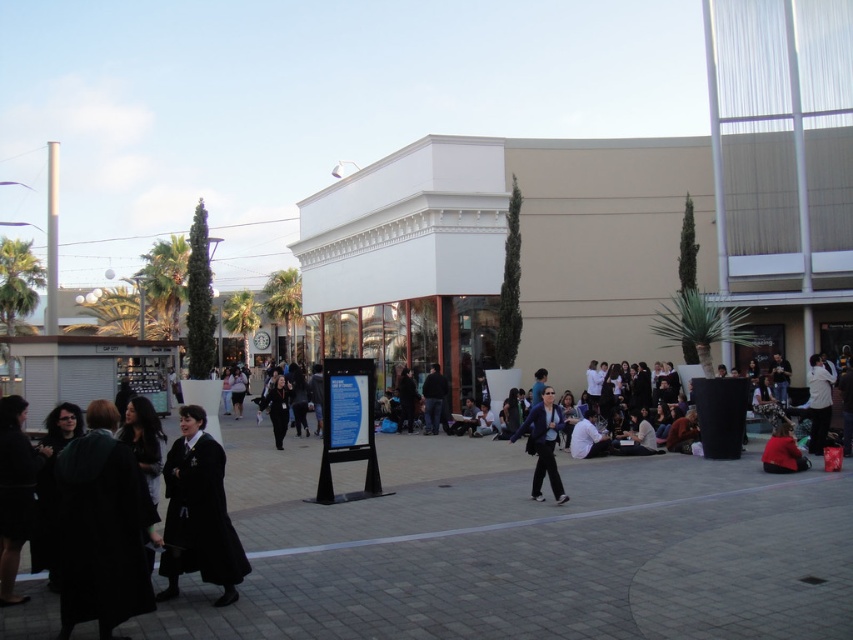
Does matte blue jacket at center have a lesser width compared to red fabric jacket at lower right?

Yes.

At what (x,y) coordinates should I click in order to perform the action: click on matte blue jacket at center. Please return your answer as a coordinate pair (x, y). The height and width of the screenshot is (640, 853). Looking at the image, I should click on (543, 444).

Is black fabric coat at center wider than matte blue jacket at center?

Correct, the width of black fabric coat at center exceeds that of matte blue jacket at center.

Describe the element at coordinates (198, 513) in the screenshot. The width and height of the screenshot is (853, 640). I see `black fabric coat at center` at that location.

Identify the location of black fabric coat at center. (198, 513).

Between dark green wool coat at lower left and red fabric jacket at lower right, which one has less height?

With less height is red fabric jacket at lower right.

The height and width of the screenshot is (640, 853). What do you see at coordinates (102, 528) in the screenshot?
I see `dark green wool coat at lower left` at bounding box center [102, 528].

I want to click on dark green wool coat at lower left, so click(102, 528).